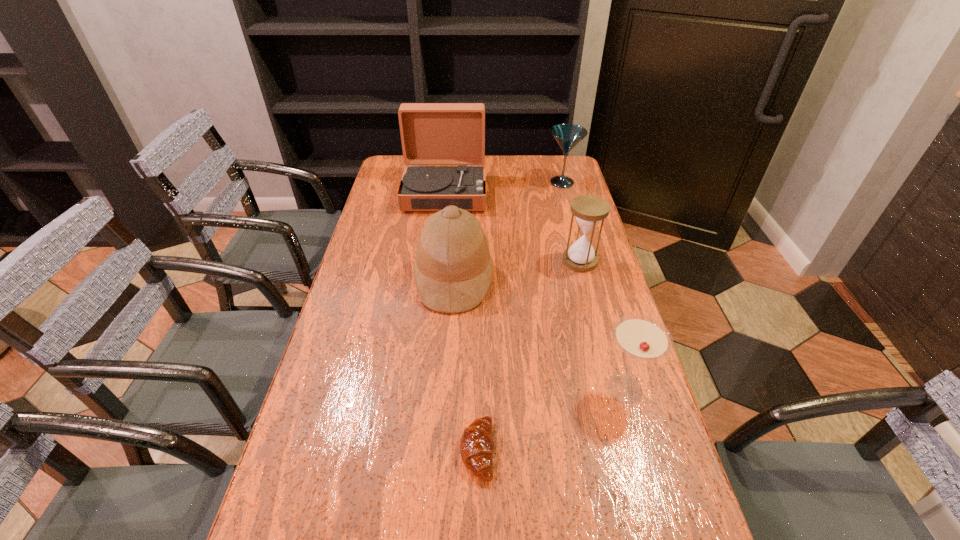
Where is `free point between the crescent roll and the farther martini`? free point between the crescent roll and the farther martini is located at coordinates (519, 316).

In order to click on vacant area between the crescent roll and the hourglass in this screenshot , I will do `click(529, 356)`.

Locate an element on the screen. The image size is (960, 540). free space between the shortest object and the tallest object is located at coordinates (461, 322).

Locate which object ranks fifth in proximity to the farther martini. Please provide its 2D coordinates. Your answer should be formatted as a tuple, i.e. [(x, y)], where the tuple contains the x and y coordinates of a point satisfying the conditions above.

[(477, 446)]

Locate an element on the screen. The width and height of the screenshot is (960, 540). object that is the closest to the hourglass is located at coordinates (453, 268).

This screenshot has width=960, height=540. I want to click on free location that satisfies the following two spatial constraints: 1. on the front side of the hourglass; 2. on the front-facing side of the hat, so click(x=585, y=279).

Where is `free space that satisfies the following two spatial constraints: 1. on the face of the phonograph record; 2. on the left side of the nearest object`? free space that satisfies the following two spatial constraints: 1. on the face of the phonograph record; 2. on the left side of the nearest object is located at coordinates (416, 451).

You are a GUI agent. You are given a task and a screenshot of the screen. Output one action in this format:
    pyautogui.click(x=<x>, y=<y>)
    Task: Click on the vacant space that satisfies the following two spatial constraints: 1. on the face of the hourglass; 2. on the right side of the phonograph record
    The height and width of the screenshot is (540, 960).
    Given the screenshot: What is the action you would take?
    pyautogui.click(x=437, y=261)

Locate an element on the screen. vacant space that satisfies the following two spatial constraints: 1. on the face of the hourglass; 2. on the left side of the tallest object is located at coordinates (437, 261).